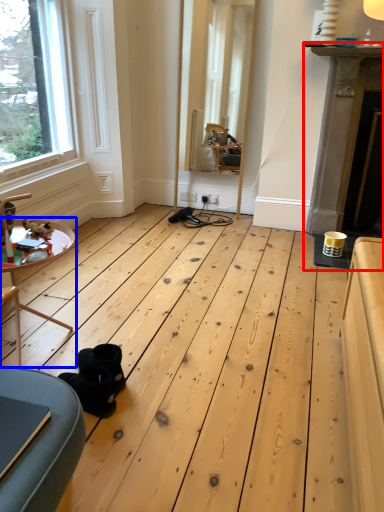
Question: Which object appears farthest to the camera in this image, fireplace (highlighted by a red box) or table (highlighted by a blue box)?

Choices:
 (A) fireplace
 (B) table

Answer: (A)